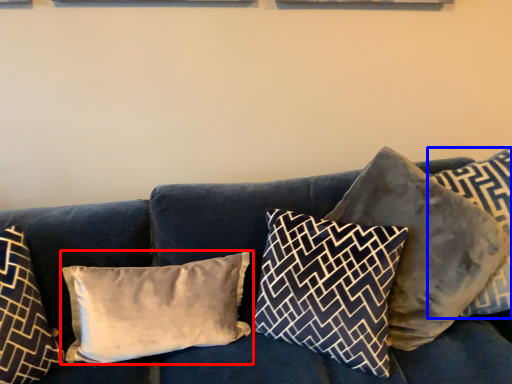
Question: Which point is further to the camera, pillow (highlighted by a red box) or pillow (highlighted by a blue box)?

Choices:
 (A) pillow
 (B) pillow

Answer: (A)